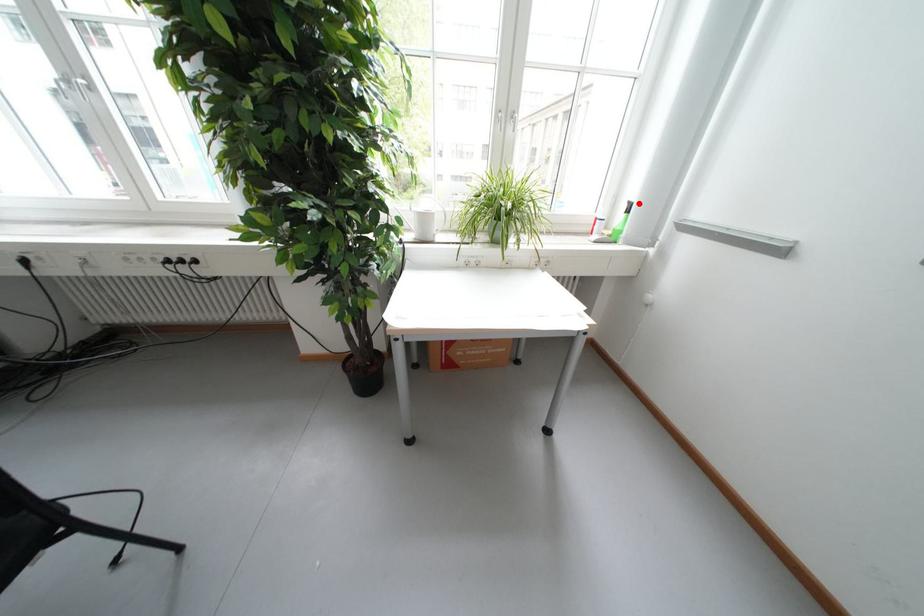
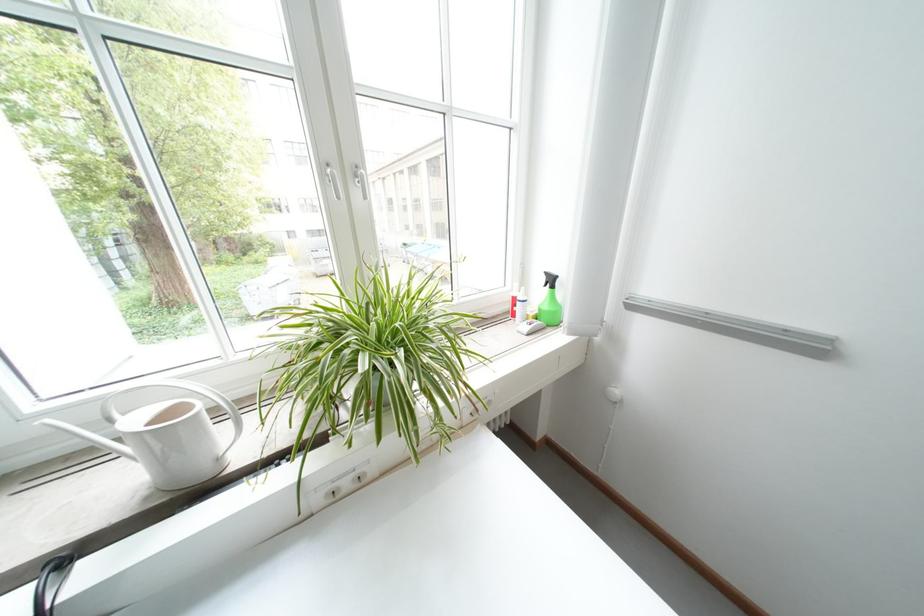
The point at the highlighted location is marked in the first image. Where is the corresponding point in the second image?

(555, 275)